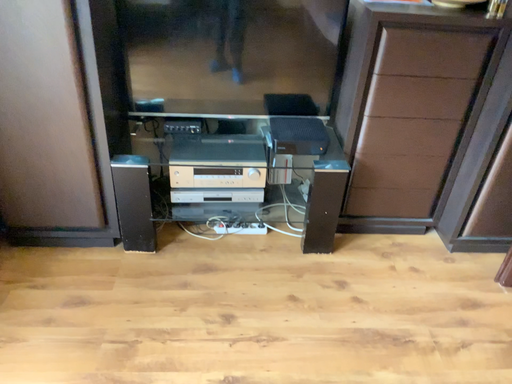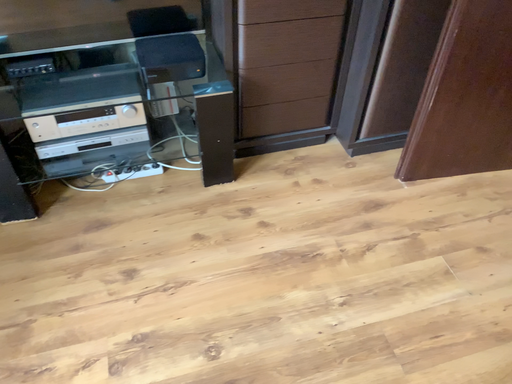
Question: Which way did the camera rotate in the video?

Choices:
 (A) rotated right
 (B) rotated left

Answer: (A)